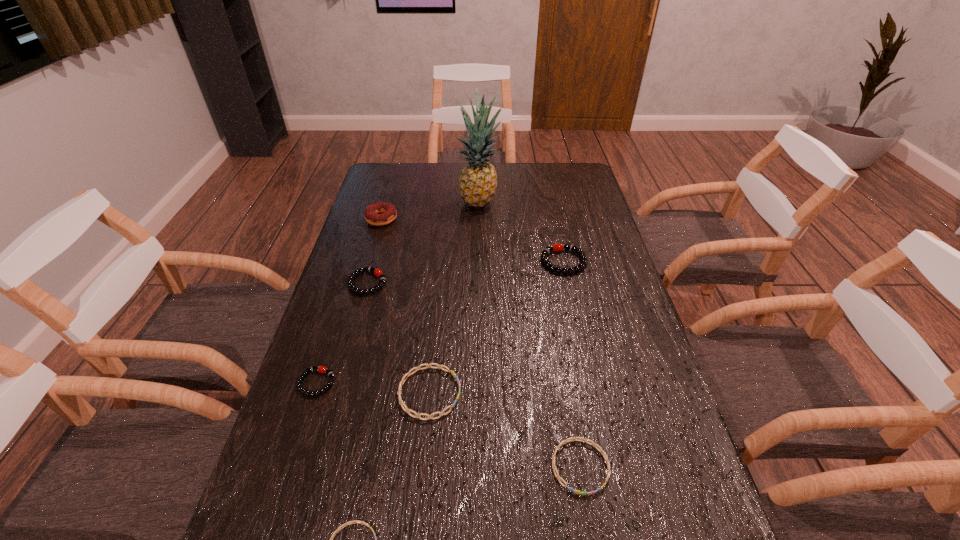
At what (x,y) coordinates should I click in order to perform the action: click on the tallest object. Please return your answer as a coordinate pair (x, y). This screenshot has height=540, width=960. Looking at the image, I should click on (478, 180).

Locate an element on the screen. This screenshot has width=960, height=540. pineapple is located at coordinates (478, 180).

Where is `the second tallest object`? Image resolution: width=960 pixels, height=540 pixels. the second tallest object is located at coordinates (372, 214).

Where is `doughnut`? The width and height of the screenshot is (960, 540). doughnut is located at coordinates (372, 214).

Locate an element on the screen. The height and width of the screenshot is (540, 960). the biggest black bracelet is located at coordinates (555, 247).

The width and height of the screenshot is (960, 540). What are the coordinates of `the farthest blue bracelet` in the screenshot? It's located at (408, 374).

Locate an element on the screen. This screenshot has width=960, height=540. the second smallest black bracelet is located at coordinates (377, 272).

At what (x,y) coordinates should I click in order to perform the action: click on the seventh farthest object. Please return your answer as a coordinate pair (x, y). The width and height of the screenshot is (960, 540). Looking at the image, I should click on (601, 451).

The image size is (960, 540). In order to click on the second farthest blue bracelet in this screenshot , I will do `click(601, 451)`.

In order to click on the smallest black bracelet in this screenshot , I will do `click(321, 369)`.